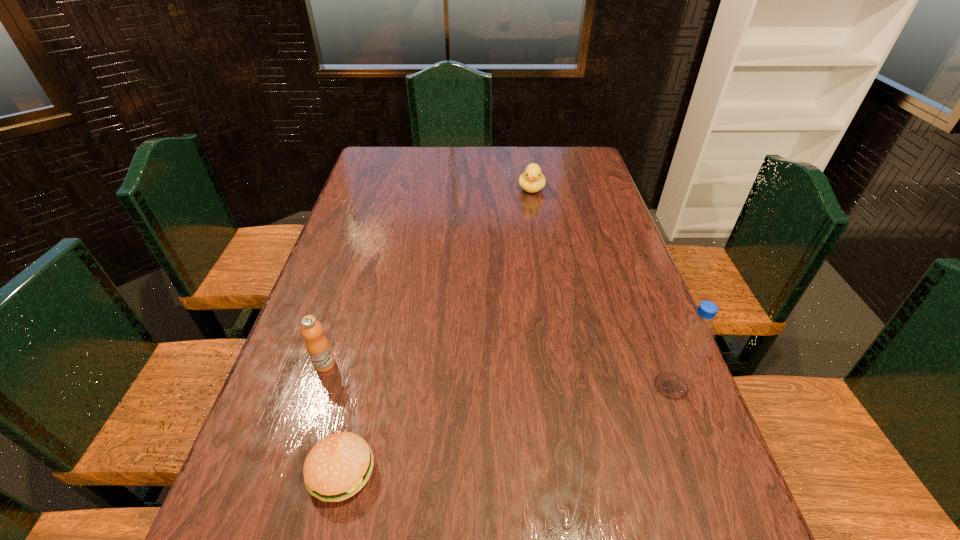
Identify the location of free space between the rightmost object and the nearest object. (507, 428).

The height and width of the screenshot is (540, 960). I want to click on free area in between the second nearest object and the leftmost object, so click(x=498, y=375).

You are a GUI agent. You are given a task and a screenshot of the screen. Output one action in this format:
    pyautogui.click(x=<x>, y=<y>)
    Task: Click on the vacant space that's between the third farthest object and the farthest object
    This screenshot has height=540, width=960.
    Given the screenshot: What is the action you would take?
    pyautogui.click(x=602, y=287)

You are a GUI agent. You are given a task and a screenshot of the screen. Output one action in this format:
    pyautogui.click(x=<x>, y=<y>)
    Task: Click on the vacant area that lies between the nearest object and the third object from left to right
    
    Given the screenshot: What is the action you would take?
    pyautogui.click(x=437, y=330)

I want to click on empty space that is in between the water bottle and the nearest object, so click(x=507, y=428).

What are the coordinates of `unoccupied area between the second nearest object and the second object from left to right` in the screenshot? It's located at (507, 428).

Select which object is the third closest to the orange juice. Please provide its 2D coordinates. Your answer should be formatted as a tuple, i.e. [(x, y)], where the tuple contains the x and y coordinates of a point satisfying the conditions above.

[(532, 180)]

This screenshot has height=540, width=960. What are the coordinates of `the third closest object to the patty` in the screenshot? It's located at (532, 180).

The width and height of the screenshot is (960, 540). In order to click on free space that satisfies the following two spatial constraints: 1. on the back side of the second shortest object; 2. on the left side of the shortest object in this screenshot , I will do `click(408, 189)`.